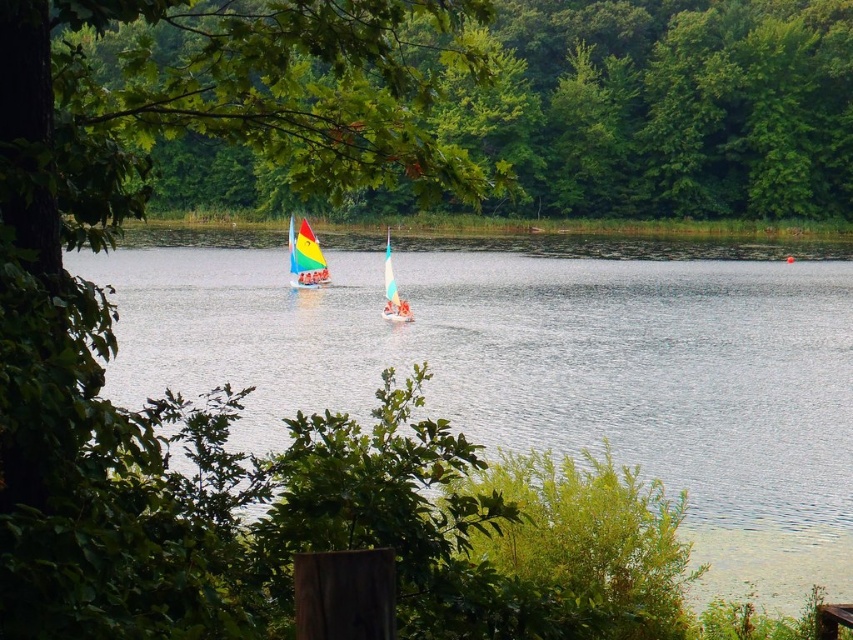
You are a photographer wanting to capture the rainbow sailboat at center and the clear water at center in your shot. Which object is positioned to the right of the other?

The clear water at center is to the right of the rainbow sailboat at center.

You are standing at the lakeside and see a rainbow sailboat at center. There is a point marked at coordinates [305,257]. Can you tell me where this point is located?

The point at [305,257] is located on the rainbow sailboat at center.